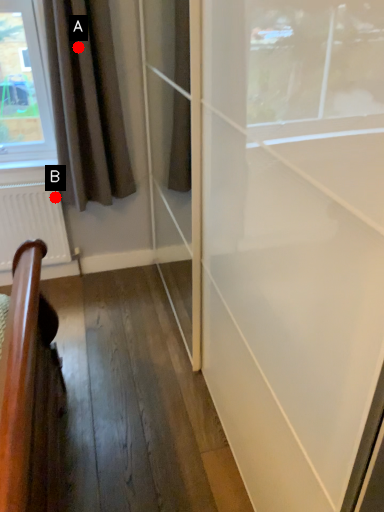
Question: Two points are circled on the image, labeled by A and B beside each circle. Which of the following is the farthest from the observer?

Choices:
 (A) A is further
 (B) B is further

Answer: (B)